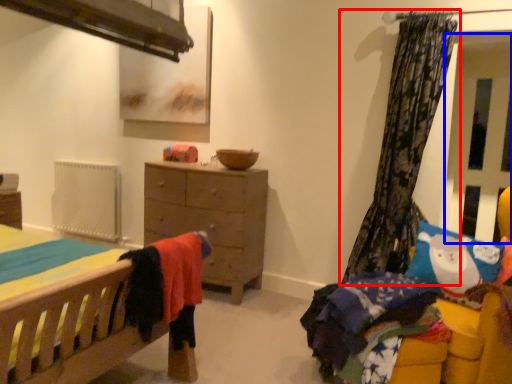
Question: Which point is closer to the camera, curtain (highlighted by a red box) or screen door (highlighted by a blue box)?

Choices:
 (A) curtain
 (B) screen door

Answer: (A)